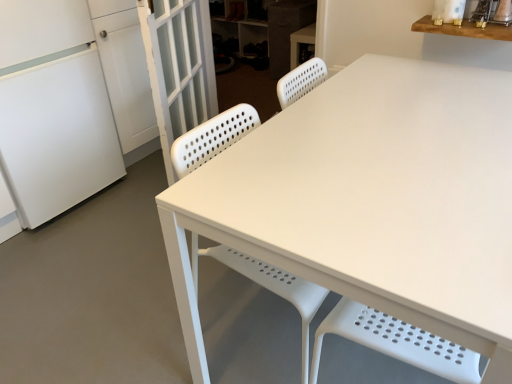
Question: Is point (27, 46) closer or farther from the camera than point (478, 33)?

Choices:
 (A) farther
 (B) closer

Answer: (A)

Question: Is white matte refrigerator at left spatially inside wooden shelf at upper right, or outside of it?

Choices:
 (A) inside
 (B) outside

Answer: (B)

Question: Estimate the real-world distances between objects in this image. Which object is closer to the white perforated plastic chair at center?

Choices:
 (A) wooden shelf at upper right
 (B) white matte refrigerator at left
 (C) gray fabric cabinet at upper center, the first cabinetry viewed from the front
 (D) white textured screen door at left
 (E) white matte cabinet at upper center, the 1th cabinetry in the back-to-front sequence

Answer: (D)

Question: Based on their relative distances, which object is nearer to the white matte cabinet at upper center, the 1th cabinetry in the back-to-front sequence?

Choices:
 (A) white perforated plastic chair at center
 (B) white matte refrigerator at left
 (C) wooden shelf at upper right
 (D) white textured screen door at left
 (E) gray fabric cabinet at upper center, which ranks as the 2th cabinetry in back-to-front order

Answer: (E)